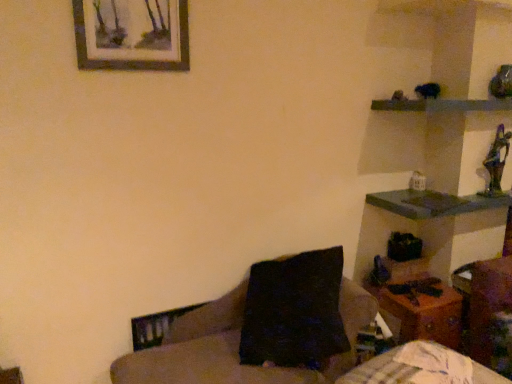
Identify the location of free point above wooden table at lower right (from a real-world perspective). (412, 281).